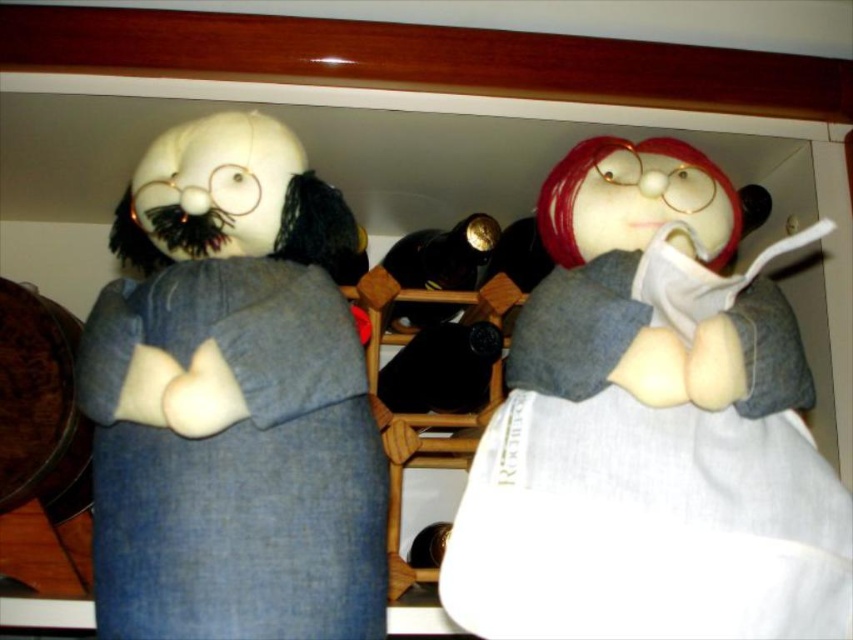
Question: Which object is farther from the camera taking this photo?

Choices:
 (A) denim jacket at left
 (B) white fabric doll at upper right

Answer: (B)

Question: Can you confirm if white fabric doll at upper right is positioned above denim jacket at left?

Choices:
 (A) yes
 (B) no

Answer: (A)

Question: Can you confirm if white fabric doll at upper right is positioned to the right of denim jacket at left?

Choices:
 (A) yes
 (B) no

Answer: (A)

Question: Does white fabric doll at upper right have a greater width compared to denim jacket at left?

Choices:
 (A) no
 (B) yes

Answer: (B)